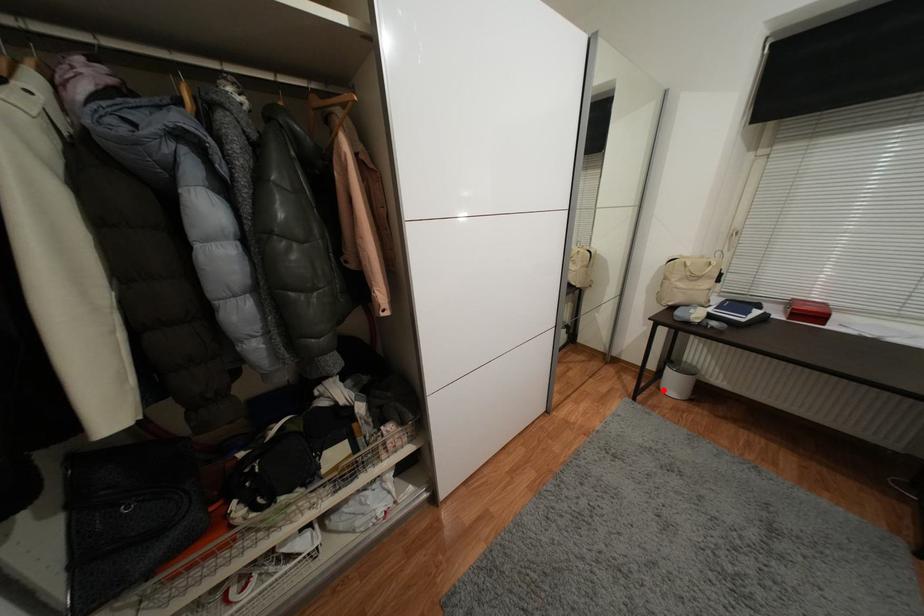
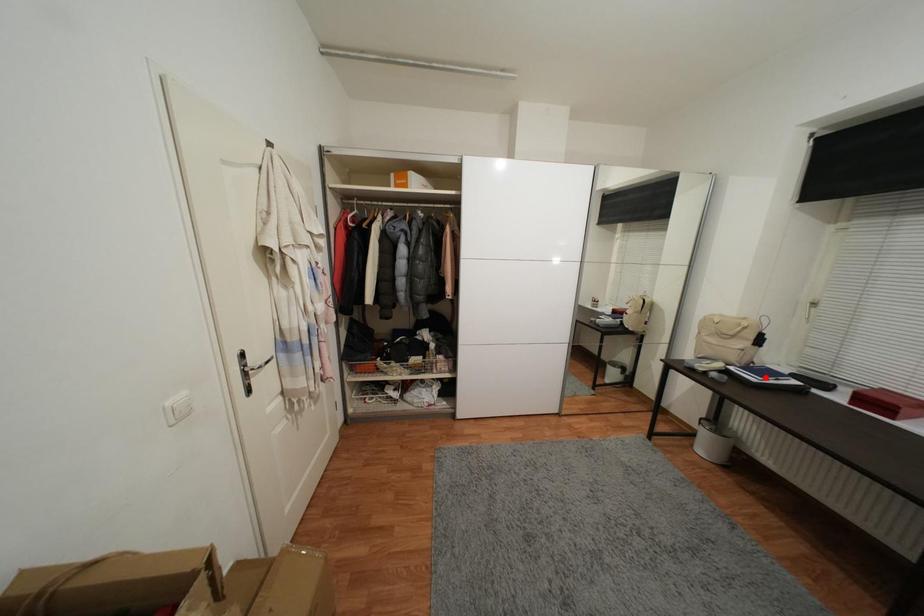
I am providing you with two images of the same scene from different viewpoints. A red point is marked on the first image and another point is marked on the second image. Do the highlighted points in image1 and image2 indicate the same real-world spot?

No